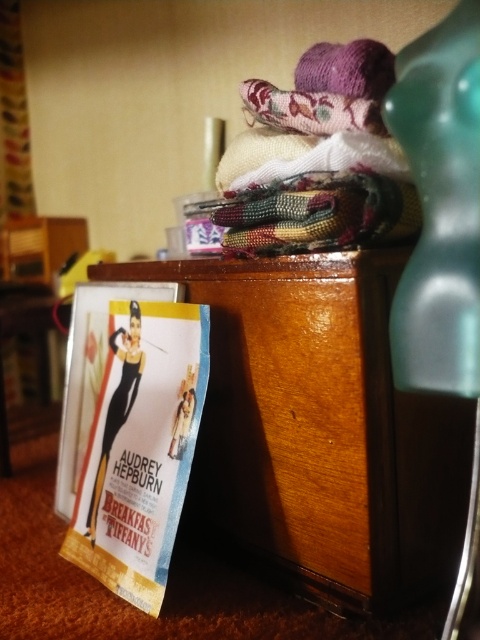
Question: Does wooden dresser at lower left appear under matte paper poster at lower left?

Choices:
 (A) no
 (B) yes

Answer: (A)

Question: Which point is closer to the camera?

Choices:
 (A) matte paper poster at lower left
 (B) wooden dresser at lower left

Answer: (B)

Question: Can you confirm if wooden dresser at lower left is wider than matte paper poster at lower left?

Choices:
 (A) no
 (B) yes

Answer: (B)

Question: Can you confirm if wooden dresser at lower left is positioned above matte paper poster at lower left?

Choices:
 (A) no
 (B) yes

Answer: (B)

Question: Which point is closer to the camera taking this photo?

Choices:
 (A) (99, 499)
 (B) (320, 426)

Answer: (B)

Question: Which point is closer to the camera?

Choices:
 (A) matte paper poster at lower left
 (B) wooden dresser at lower left

Answer: (B)